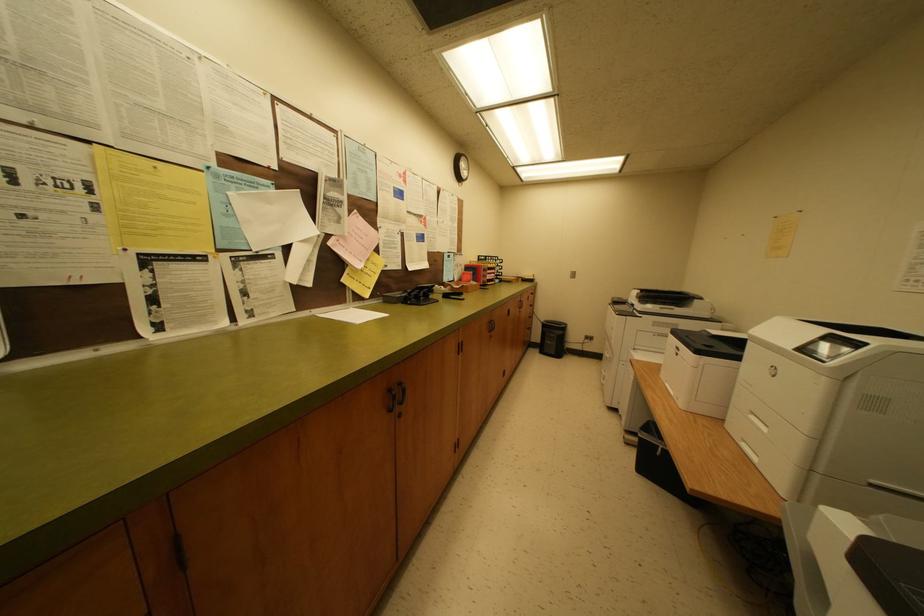
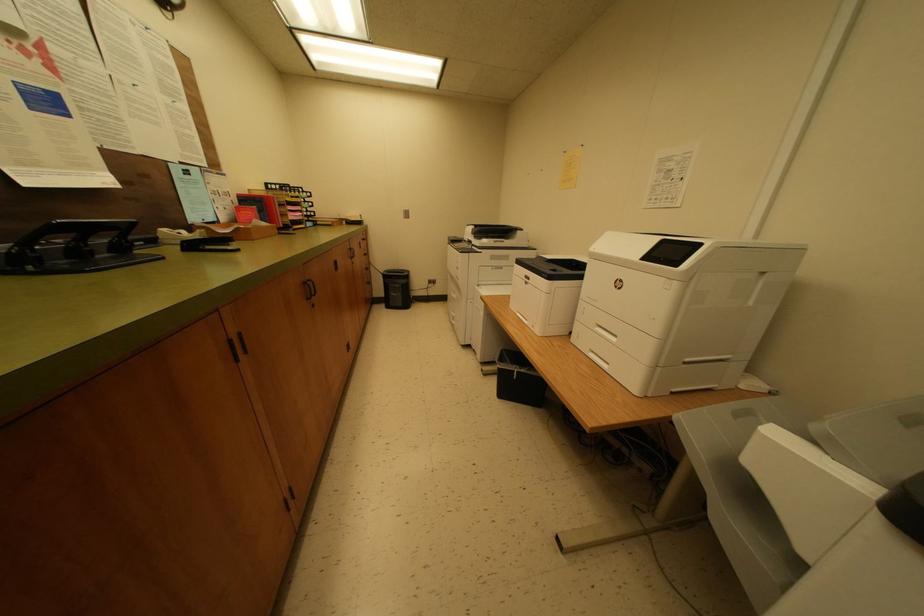
Question: How did the camera likely rotate?

Choices:
 (A) Left
 (B) Right
 (C) Up
 (D) Down

Answer: (B)